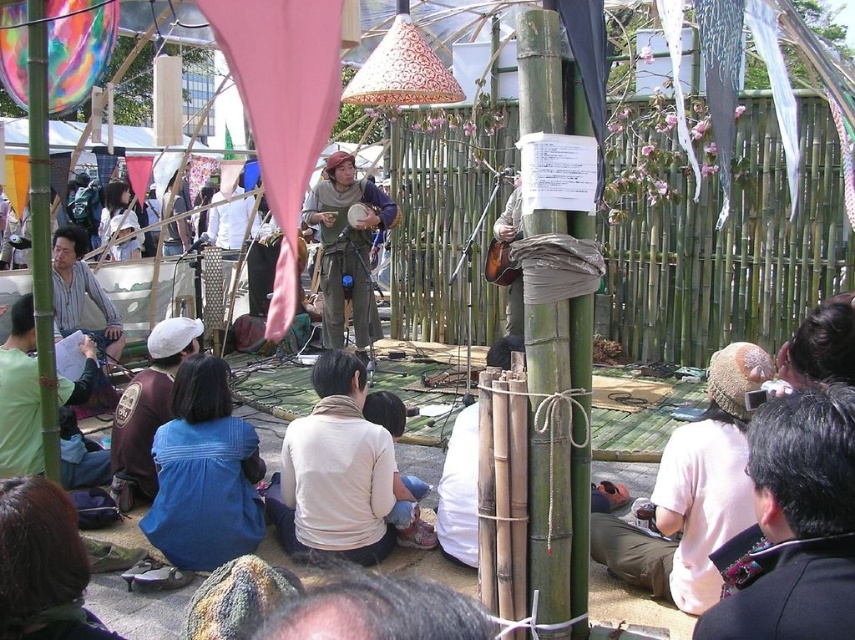
You are a photographer setting up a tripod in this outdoor festival scene. You need to position it so that both the dark brown suit at lower right and the green canvas pants at center are visible in the frame. Considering their heights, which object should you place closer to the camera to ensure both are fully visible?

The dark brown suit at lower right is not as tall as the green canvas pants at center, so you should place the dark brown suit at lower right closer to the camera to ensure both are fully visible in the frame.

What is located at the coordinates point (346,248) in the image?

The coordinates point (346,248) corresponds to the green canvas pants at center.

You are a photographer trying to capture a photo of the green canvas pants at center and the green bamboo pole at left. Which object should you focus on first if you want to ensure both are in the frame without moving the camera?

The green canvas pants at center is taller than the green bamboo pole at left, so you should focus on the green canvas pants at center first to ensure both are in the frame without moving the camera.